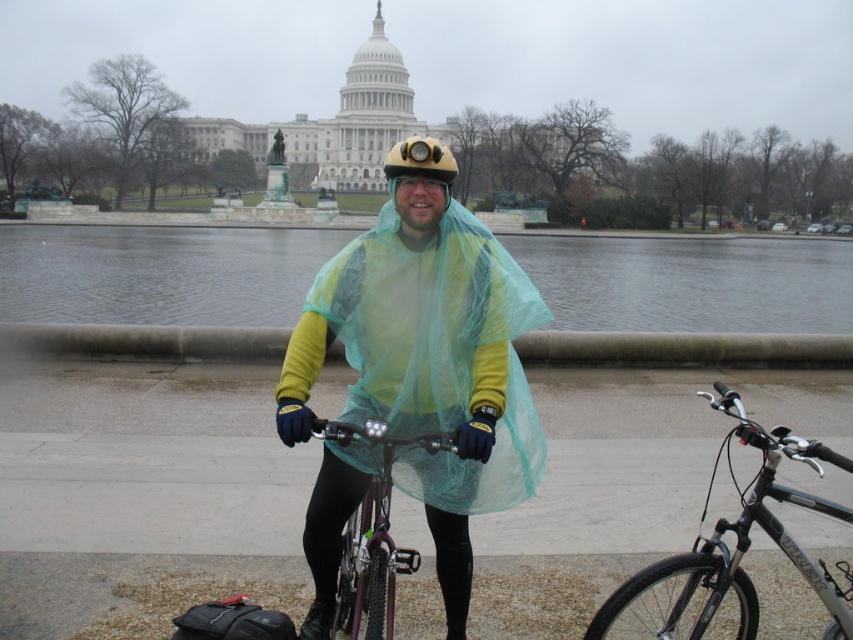
From the picture: Which is below, translucent green poncho at center or yellow matte helmet at center?

translucent green poncho at center is lower down.

Does translucent green poncho at center appear over yellow matte helmet at center?

Actually, translucent green poncho at center is below yellow matte helmet at center.

Does point (308, 538) come farther from viewer compared to point (401, 144)?

That is False.

The image size is (853, 640). I want to click on translucent green poncho at center, so click(428, 362).

The image size is (853, 640). What do you see at coordinates (428, 362) in the screenshot? I see `translucent green poncho at center` at bounding box center [428, 362].

Does translucent green poncho at center have a greater height compared to silver metallic bicycle at center?

Yes.

Is point (457, 557) closer to camera compared to point (770, 435)?

Yes, point (457, 557) is in front of point (770, 435).

You are a GUI agent. You are given a task and a screenshot of the screen. Output one action in this format:
    pyautogui.click(x=<x>, y=<y>)
    Task: Click on the translucent green poncho at center
    The height and width of the screenshot is (640, 853).
    Given the screenshot: What is the action you would take?
    pyautogui.click(x=428, y=362)

Between point (450, 259) and point (347, 592), which one is positioned behind?

The point (450, 259) is more distant.

Describe the element at coordinates (428, 362) in the screenshot. I see `translucent green poncho at center` at that location.

Find the location of `translucent green poncho at center`. translucent green poncho at center is located at coordinates (428, 362).